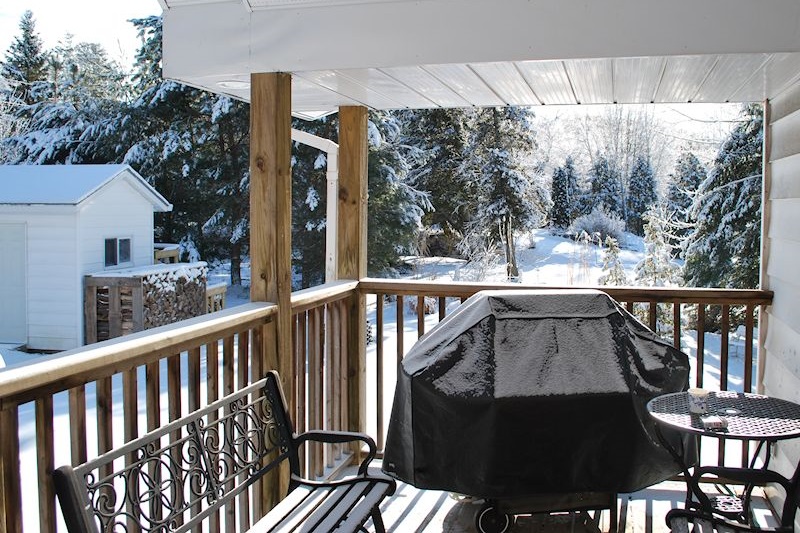
Find the location of a particular element. This screenshot has height=533, width=800. round table top is located at coordinates (757, 415).